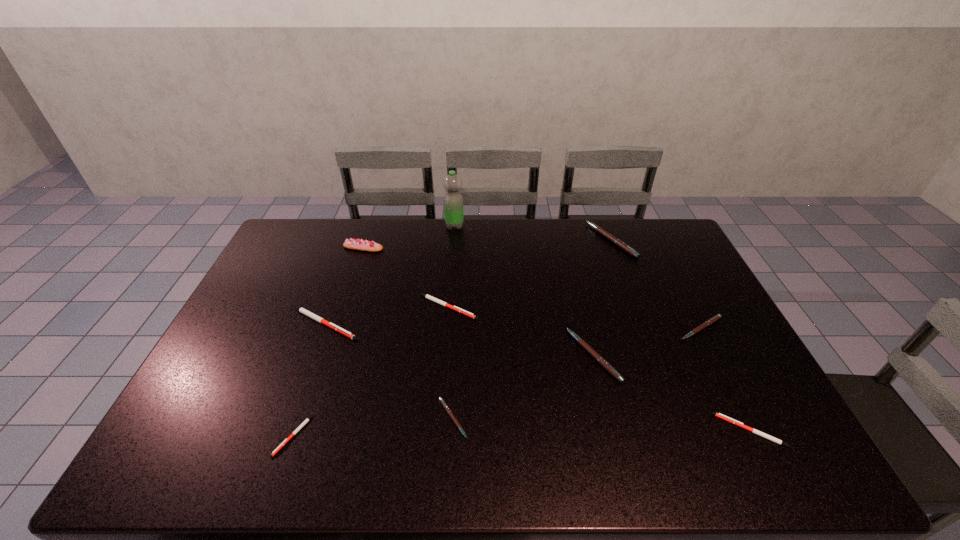
Where is `free space located 0.190m at the nib of the fourth pen from right to left`? This screenshot has height=540, width=960. free space located 0.190m at the nib of the fourth pen from right to left is located at coordinates (504, 356).

You are a GUI agent. You are given a task and a screenshot of the screen. Output one action in this format:
    pyautogui.click(x=<x>, y=<y>)
    Task: Click on the vacant region located at the nib of the fourth pen from right to left
    This screenshot has height=540, width=960.
    Given the screenshot: What is the action you would take?
    pyautogui.click(x=494, y=356)

At what (x,y) coordinates should I click in order to perform the action: click on free region located at the nib of the fourth pen from right to left. Please return your answer as a coordinate pair (x, y). This screenshot has height=540, width=960. Looking at the image, I should click on (497, 356).

Locate an element on the screen. The image size is (960, 540). blank space located on the clicker of the biggest white pen is located at coordinates (420, 323).

The height and width of the screenshot is (540, 960). I want to click on free space located 0.280m at the nib of the second smallest pink pen, so click(x=752, y=428).

This screenshot has width=960, height=540. In order to click on free space located 0.380m on the clicker of the second biggest white pen in this screenshot , I will do `click(597, 307)`.

At what (x,y) coordinates should I click in order to perform the action: click on vacant area situated at the nib of the smallest pink pen. Please return your answer as a coordinate pair (x, y). Looking at the image, I should click on (591, 418).

In order to click on free space located on the clicker of the third biggest white pen in this screenshot , I will do `click(605, 430)`.

Find the location of a particular element. vacant area located on the clicker of the third biggest white pen is located at coordinates (572, 430).

Locate an element on the screen. The height and width of the screenshot is (540, 960). free space located on the clicker of the third biggest white pen is located at coordinates (678, 430).